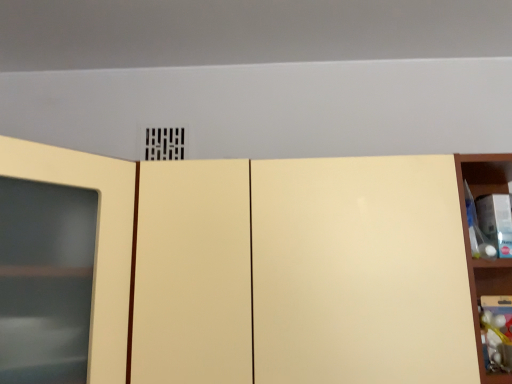
Question: Considering their positions, is matte wood shelf at right located in front of or behind matte yellow cabinet at center?

Choices:
 (A) behind
 (B) front

Answer: (A)

Question: Is matte wood shelf at right bigger or smaller than matte yellow cabinet at center?

Choices:
 (A) small
 (B) big

Answer: (A)

Question: In terms of height, does matte wood shelf at right look taller or shorter compared to matte yellow cabinet at center?

Choices:
 (A) short
 (B) tall

Answer: (B)

Question: Is matte yellow cabinet at center spatially inside matte wood shelf at right, or outside of it?

Choices:
 (A) inside
 (B) outside

Answer: (B)

Question: Is point (373, 157) closer or farther from the camera than point (509, 279)?

Choices:
 (A) closer
 (B) farther

Answer: (A)

Question: Is matte yellow cabinet at center taller or shorter than matte wood shelf at right?

Choices:
 (A) short
 (B) tall

Answer: (A)

Question: From the image's perspective, is matte yellow cabinet at center located above or below matte wood shelf at right?

Choices:
 (A) above
 (B) below

Answer: (A)